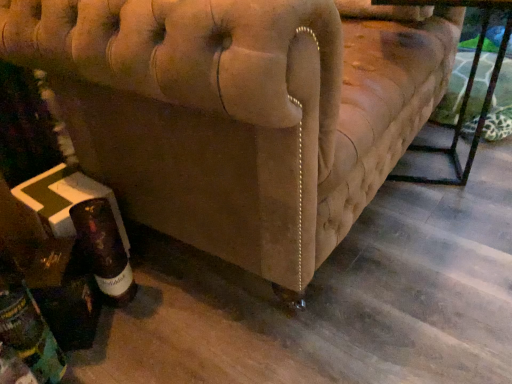
Question: Does brown glass bottle at lower left, placed as the 1th bottle when sorted from right to left, have a smaller size compared to metallic black table at lower right?

Choices:
 (A) yes
 (B) no

Answer: (A)

Question: Considering the relative positions of brown glass bottle at lower left, which appears as the second bottle when viewed from the left, and metallic black table at lower right in the image provided, is brown glass bottle at lower left, which appears as the second bottle when viewed from the left, to the left of metallic black table at lower right from the viewer's perspective?

Choices:
 (A) no
 (B) yes

Answer: (B)

Question: Is the depth of brown glass bottle at lower left, which appears as the second bottle when viewed from the left, greater than that of metallic black table at lower right?

Choices:
 (A) no
 (B) yes

Answer: (A)

Question: Is metallic black table at lower right inside brown glass bottle at lower left, which appears as the second bottle when viewed from the left?

Choices:
 (A) yes
 (B) no

Answer: (B)

Question: Is brown glass bottle at lower left, which appears as the second bottle when viewed from the left, aimed at metallic black table at lower right?

Choices:
 (A) yes
 (B) no

Answer: (B)

Question: Is point (22, 317) closer or farther from the camera than point (400, 1)?

Choices:
 (A) closer
 (B) farther

Answer: (A)

Question: From the image's perspective, is dark brown glass bottle at lower left, the first bottle from the left, positioned above or below metallic black table at lower right?

Choices:
 (A) below
 (B) above

Answer: (A)

Question: Is dark brown glass bottle at lower left, the first bottle from the left, taller or shorter than metallic black table at lower right?

Choices:
 (A) short
 (B) tall

Answer: (A)

Question: Looking at the image, does dark brown glass bottle at lower left, which is the second bottle from right to left, seem bigger or smaller compared to metallic black table at lower right?

Choices:
 (A) small
 (B) big

Answer: (A)

Question: Is brown glass bottle at lower left, placed as the 1th bottle when sorted from right to left, spatially inside dark brown glass bottle at lower left, which is the second bottle from right to left, or outside of it?

Choices:
 (A) outside
 (B) inside

Answer: (A)

Question: From a real-world perspective, is brown glass bottle at lower left, placed as the 1th bottle when sorted from right to left, positioned above or below dark brown glass bottle at lower left, which is the second bottle from right to left?

Choices:
 (A) below
 (B) above

Answer: (A)

Question: Is brown glass bottle at lower left, which appears as the second bottle when viewed from the left, to the left or to the right of dark brown glass bottle at lower left, which is the second bottle from right to left, in the image?

Choices:
 (A) right
 (B) left

Answer: (A)

Question: In terms of height, does brown glass bottle at lower left, placed as the 1th bottle when sorted from right to left, look taller or shorter compared to dark brown glass bottle at lower left, which is the second bottle from right to left?

Choices:
 (A) short
 (B) tall

Answer: (A)

Question: Looking at their shapes, would you say brown glass bottle at lower left, which appears as the second bottle when viewed from the left, is wider or thinner than beige fabric couch at lower left?

Choices:
 (A) thin
 (B) wide

Answer: (A)

Question: In the image, is brown glass bottle at lower left, which appears as the second bottle when viewed from the left, positioned in front of or behind beige fabric couch at lower left?

Choices:
 (A) behind
 (B) front

Answer: (A)